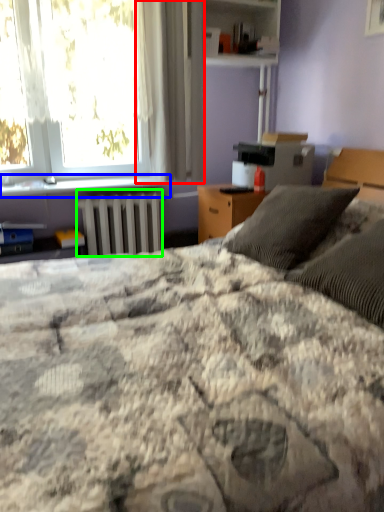
Question: Considering the real-world distances, which object is closest to curtain (highlighted by a red box)? window sill (highlighted by a blue box) or radiator (highlighted by a green box).

Choices:
 (A) window sill
 (B) radiator

Answer: (B)